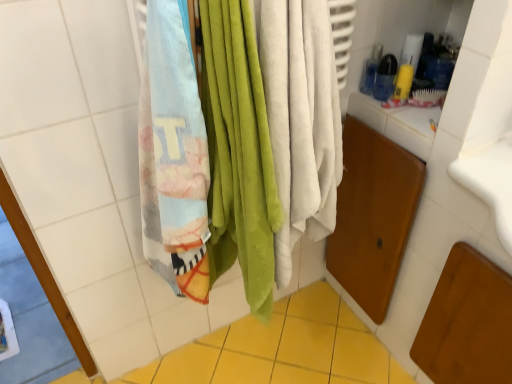
This screenshot has width=512, height=384. Describe the element at coordinates (238, 143) in the screenshot. I see `multicolored cotton beach towel at left` at that location.

At what (x,y) coordinates should I click in order to perform the action: click on multicolored cotton beach towel at left. Please return your answer as a coordinate pair (x, y). Image resolution: width=512 pixels, height=384 pixels. Looking at the image, I should click on (238, 143).

What are the coordinates of `yellow ceramic tile at lower center` in the screenshot? It's located at (283, 348).

This screenshot has width=512, height=384. What do you see at coordinates (283, 348) in the screenshot?
I see `yellow ceramic tile at lower center` at bounding box center [283, 348].

The width and height of the screenshot is (512, 384). Find the location of `multicolored cotton beach towel at left`. multicolored cotton beach towel at left is located at coordinates (238, 143).

Which is more to the left, multicolored cotton beach towel at left or yellow ceramic tile at lower center?

yellow ceramic tile at lower center.

Is the depth of multicolored cotton beach towel at left less than that of yellow ceramic tile at lower center?

Yes, multicolored cotton beach towel at left is in front of yellow ceramic tile at lower center.

Is point (178, 69) positioned behind point (223, 353)?

No, it is not.

From the image's perspective, is multicolored cotton beach towel at left above or below yellow ceramic tile at lower center?

multicolored cotton beach towel at left is above yellow ceramic tile at lower center.

From a real-world perspective, is multicolored cotton beach towel at left below yellow ceramic tile at lower center?

No, from a real-world perspective, multicolored cotton beach towel at left is not beneath yellow ceramic tile at lower center.

Considering the relative sizes of multicolored cotton beach towel at left and yellow ceramic tile at lower center in the image provided, is multicolored cotton beach towel at left thinner than yellow ceramic tile at lower center?

Yes, multicolored cotton beach towel at left is thinner than yellow ceramic tile at lower center.

From the picture: Which of these two, multicolored cotton beach towel at left or yellow ceramic tile at lower center, stands taller?

multicolored cotton beach towel at left.

Considering the relative sizes of multicolored cotton beach towel at left and yellow ceramic tile at lower center in the image provided, is multicolored cotton beach towel at left bigger than yellow ceramic tile at lower center?

Yes, multicolored cotton beach towel at left is bigger than yellow ceramic tile at lower center.

Is multicolored cotton beach towel at left completely or partially outside of yellow ceramic tile at lower center?

multicolored cotton beach towel at left is positioned outside yellow ceramic tile at lower center.

Is multicolored cotton beach towel at left far away from yellow ceramic tile at lower center?

No, multicolored cotton beach towel at left is in close proximity to yellow ceramic tile at lower center.

Does multicolored cotton beach towel at left turn towards yellow ceramic tile at lower center?

No.

In order to click on ceramic tile below the multicolored cotton beach towel at left (from the image's perspective) in this screenshot , I will do `click(283, 348)`.

Is yellow ceramic tile at lower center to the left of multicolored cotton beach towel at left from the viewer's perspective?

Indeed, yellow ceramic tile at lower center is positioned on the left side of multicolored cotton beach towel at left.

Is yellow ceramic tile at lower center closer to the viewer compared to multicolored cotton beach towel at left?

No, yellow ceramic tile at lower center is further to the viewer.

Is point (354, 360) closer or farther from the camera than point (289, 129)?

Point (354, 360) appears to be farther away from the viewer than point (289, 129).

From the image's perspective, is yellow ceramic tile at lower center located above or below multicolored cotton beach towel at left?

yellow ceramic tile at lower center is situated lower than multicolored cotton beach towel at left in the image.

From a real-world perspective, is yellow ceramic tile at lower center located beneath multicolored cotton beach towel at left?

Yes, from a real-world perspective, yellow ceramic tile at lower center is below multicolored cotton beach towel at left.

Which of these two, yellow ceramic tile at lower center or multicolored cotton beach towel at left, is wider?

Wider between the two is yellow ceramic tile at lower center.

Who is taller, yellow ceramic tile at lower center or multicolored cotton beach towel at left?

multicolored cotton beach towel at left is taller.

Considering the relative sizes of yellow ceramic tile at lower center and multicolored cotton beach towel at left in the image provided, is yellow ceramic tile at lower center smaller than multicolored cotton beach towel at left?

Yes.

Is yellow ceramic tile at lower center not inside multicolored cotton beach towel at left?

Yes.

Can you see yellow ceramic tile at lower center touching multicolored cotton beach towel at left?

No, yellow ceramic tile at lower center is not with multicolored cotton beach towel at left.

Is multicolored cotton beach towel at left at the back of yellow ceramic tile at lower center?

No.

This screenshot has height=384, width=512. I want to click on ceramic tile behind the multicolored cotton beach towel at left, so click(283, 348).

Where is `ceramic tile below the multicolored cotton beach towel at left (from a real-world perspective)`? The height and width of the screenshot is (384, 512). ceramic tile below the multicolored cotton beach towel at left (from a real-world perspective) is located at coordinates (283, 348).

Locate an element on the screen. Image resolution: width=512 pixels, height=384 pixels. beach towel above the yellow ceramic tile at lower center (from the image's perspective) is located at coordinates click(x=238, y=143).